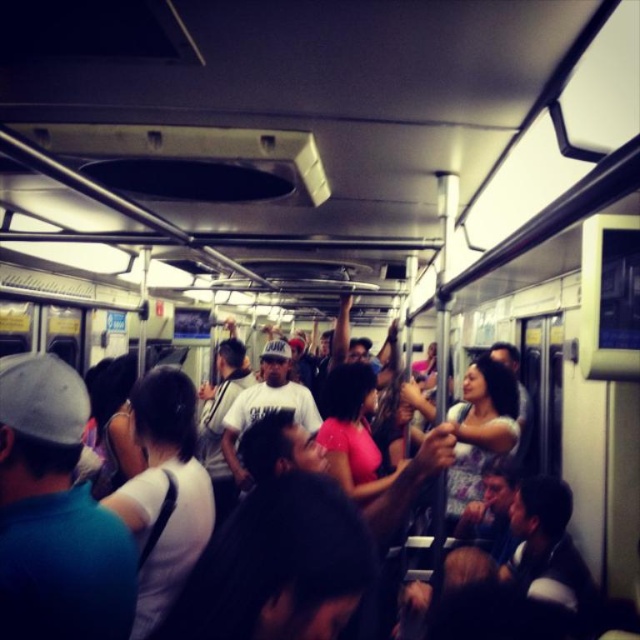
Question: Among these objects, which one is farthest from the camera?

Choices:
 (A) matte gray cap at left
 (B) white matte shirt at center

Answer: (B)

Question: Can you confirm if matte gray cap at left is bigger than white matte shirt at center?

Choices:
 (A) no
 (B) yes

Answer: (A)

Question: Among these objects, which one is nearest to the camera?

Choices:
 (A) matte gray cap at left
 (B) white matte shirt at center

Answer: (A)

Question: Considering the relative positions of matte gray cap at left and white matte shirt at center in the image provided, where is matte gray cap at left located with respect to white matte shirt at center?

Choices:
 (A) below
 (B) above

Answer: (B)

Question: Is matte gray cap at left wider than white matte shirt at center?

Choices:
 (A) no
 (B) yes

Answer: (A)